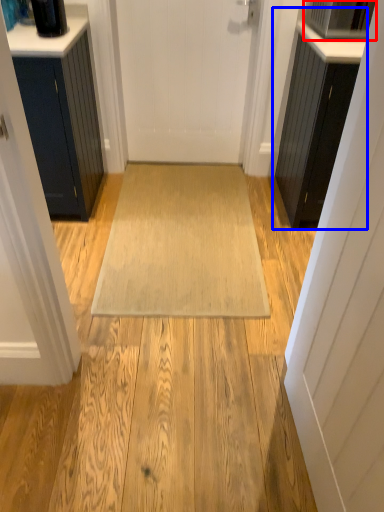
Question: Among these objects, which one is nearest to the camera, appliance (highlighted by a red box) or cabinetry (highlighted by a blue box)?

Choices:
 (A) appliance
 (B) cabinetry

Answer: (B)